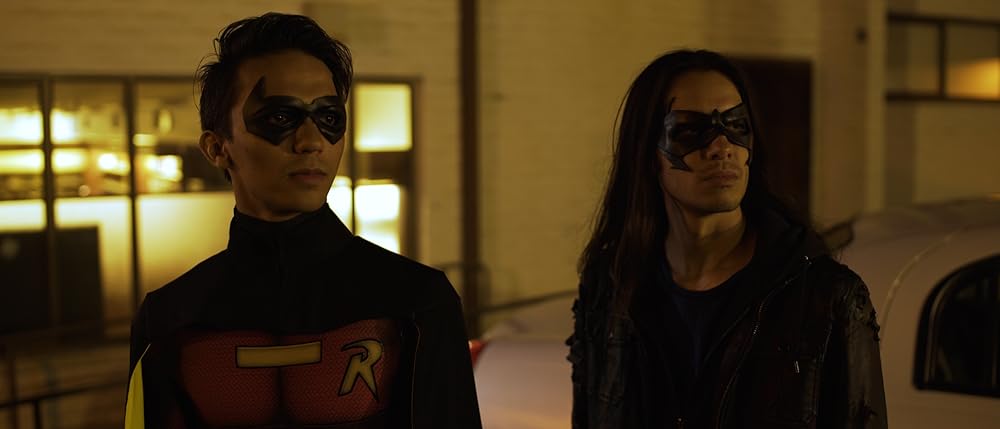
This screenshot has width=1000, height=429. Identify the location of indoor light. (61, 124).